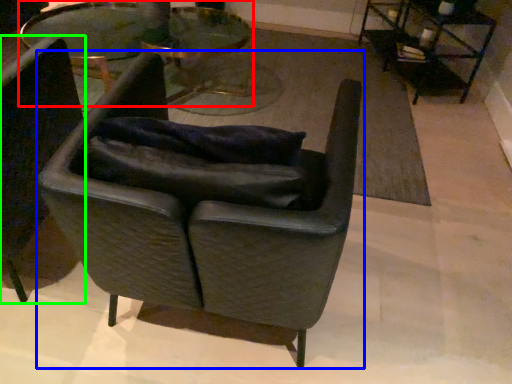
Question: Which is farther away from table (highlighted by a red box)? chair (highlighted by a blue box) or chair (highlighted by a green box)?

Choices:
 (A) chair
 (B) chair

Answer: (A)